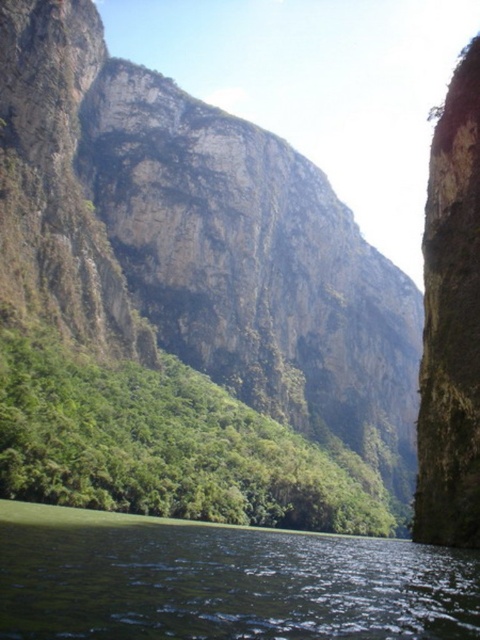
Is green smooth water at lower center bigger than green leafy vegetation at center?

Actually, green smooth water at lower center might be smaller than green leafy vegetation at center.

Between green smooth water at lower center and green leafy vegetation at center, which one is positioned lower?

green smooth water at lower center

Who is more forward, [68,612] or [173,401]?

Point [68,612]

This screenshot has height=640, width=480. I want to click on green smooth water at lower center, so click(222, 580).

From the picture: Can you confirm if rough stone mountain at center is positioned to the right of green smooth water at lower center?

In fact, rough stone mountain at center is to the left of green smooth water at lower center.

Between rough stone mountain at center and green smooth water at lower center, which one appears on the right side from the viewer's perspective?

green smooth water at lower center is more to the right.

I want to click on rough stone mountain at center, so click(195, 241).

Find the location of `rough stone mountain at center`. rough stone mountain at center is located at coordinates (195, 241).

Which is below, rough stone mountain at center or green leafy vegetation at center?

green leafy vegetation at center is below.

Consider the image. Is rough stone mountain at center thinner than green leafy vegetation at center?

In fact, rough stone mountain at center might be wider than green leafy vegetation at center.

Between point (305, 356) and point (71, 461), which one is positioned behind?

The point (305, 356) is more distant.

At what (x,y) coordinates should I click in order to perform the action: click on rough stone mountain at center. Please return your answer as a coordinate pair (x, y). This screenshot has width=480, height=640. Looking at the image, I should click on (195, 241).